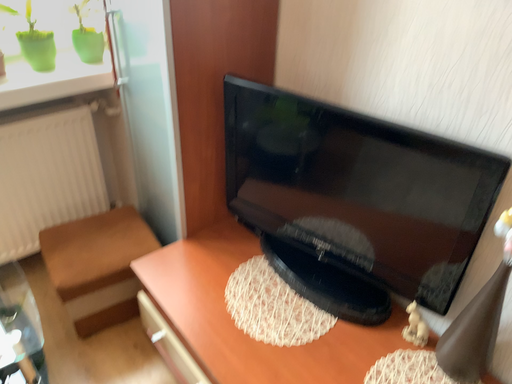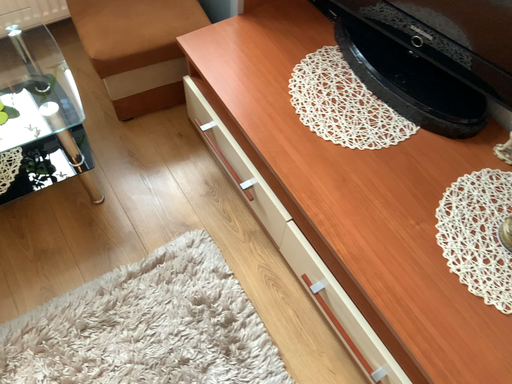
Question: Which way did the camera rotate in the video?

Choices:
 (A) rotated downward
 (B) rotated upward

Answer: (A)